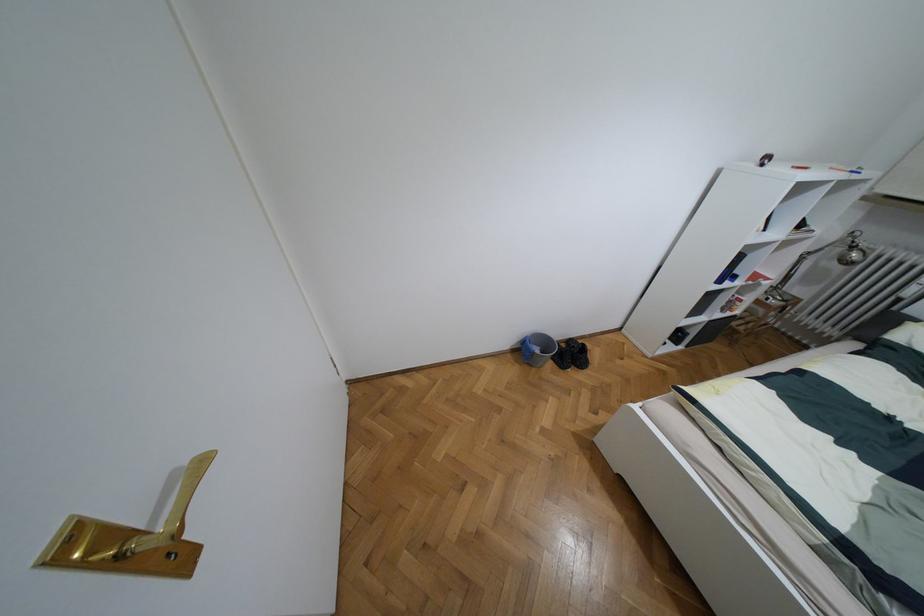
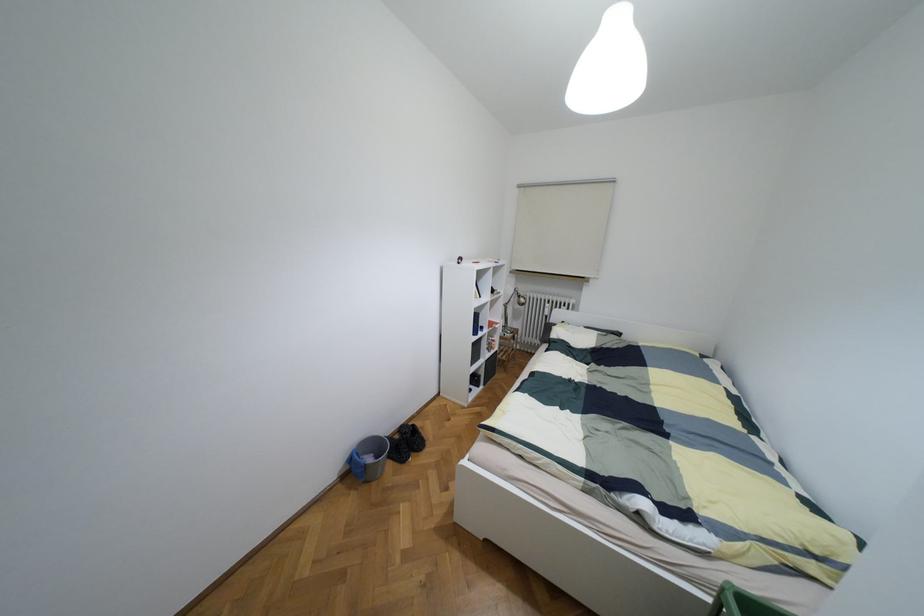
Find the pixel in the second image that matches point 582,344 in the first image.

(412, 424)